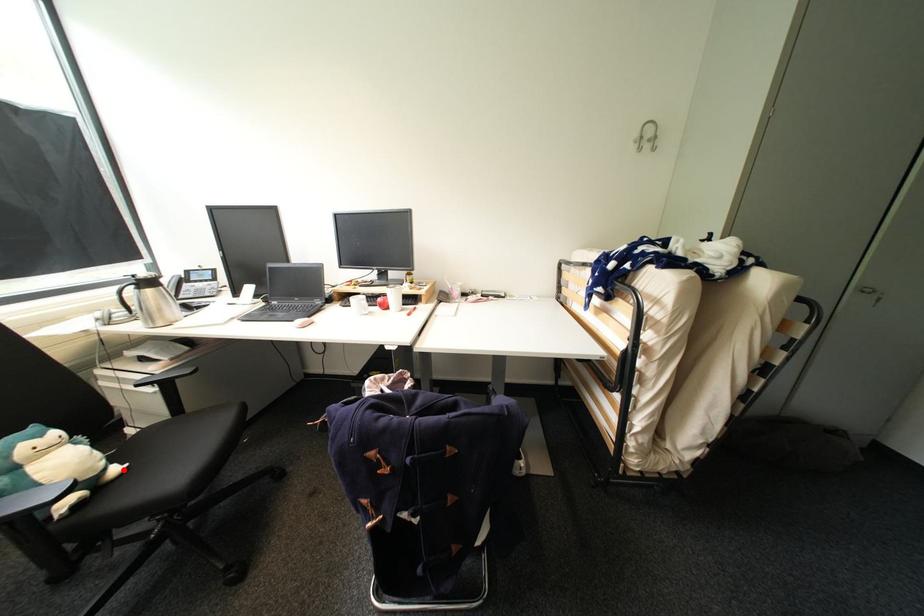
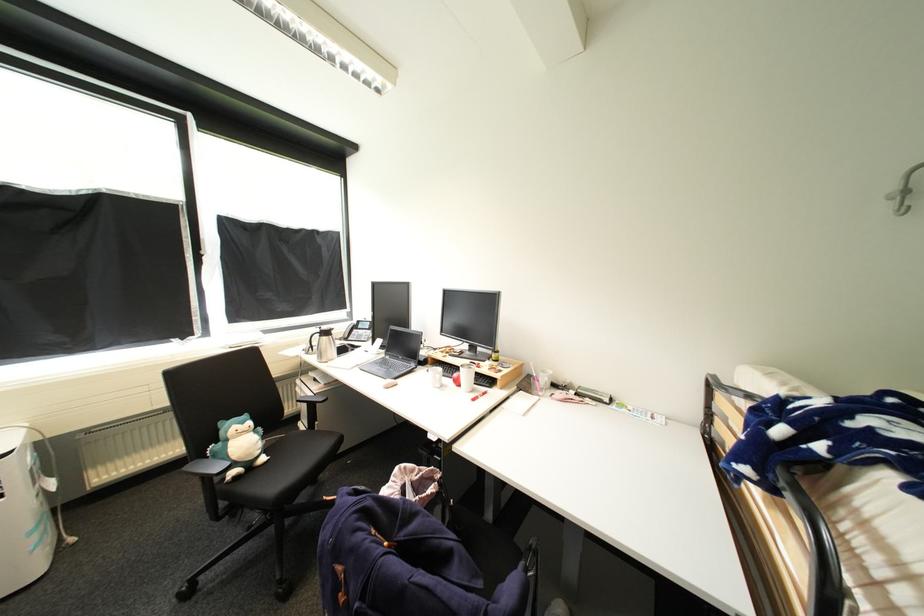
Where in the second image is the point corresponding to the highlighted location from the first image?

(270, 460)